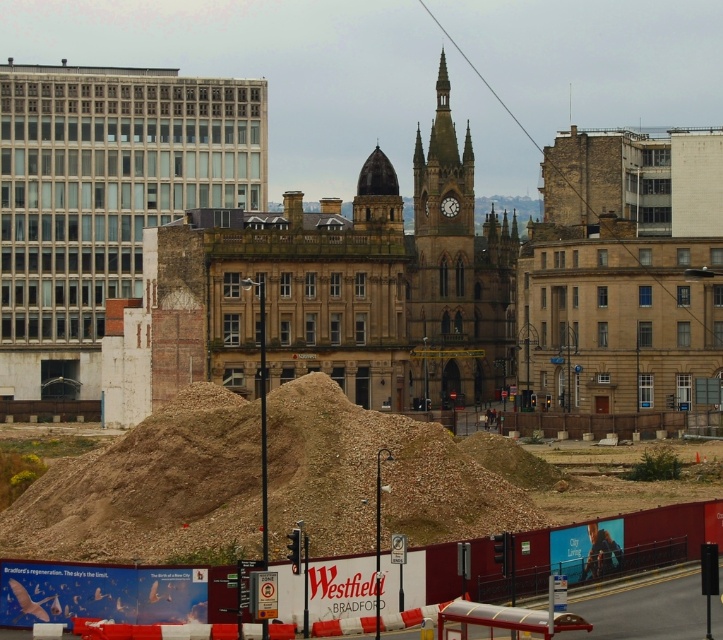
Is point (90, 285) in front of point (427, 344)?

Yes, point (90, 285) is closer to viewer.

I want to click on matte glass building at left, so pyautogui.click(x=103, y=198).

Is brown gravel mound at center positioned at the back of brown stone clock tower at center?

No, it is not.

Between brown gravel mound at center and brown stone clock tower at center, which one is positioned higher?

Positioned higher is brown stone clock tower at center.

This screenshot has width=723, height=640. What do you see at coordinates (149, 490) in the screenshot?
I see `brown gravel mound at center` at bounding box center [149, 490].

I want to click on brown gravel mound at center, so click(x=149, y=490).

The height and width of the screenshot is (640, 723). Identify the location of matte glass building at left. (103, 198).

Where is `matte glass building at left`? This screenshot has width=723, height=640. matte glass building at left is located at coordinates (103, 198).